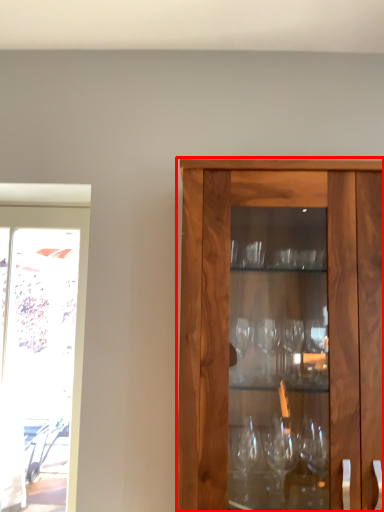
Question: In this image, where is cabinetry (annotated by the red box) located relative to screen door?

Choices:
 (A) left
 (B) right

Answer: (B)